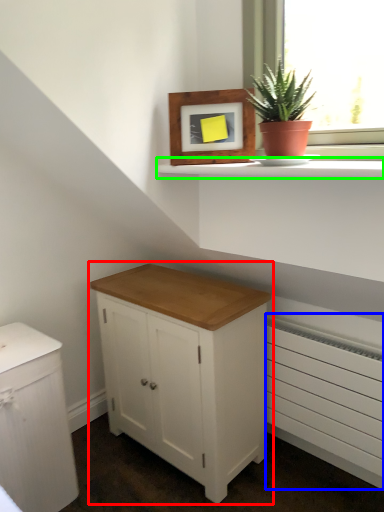
Question: Estimate the real-world distances between objects in this image. Which object is closer to chest of drawers (highlighted by a red box), radiator (highlighted by a blue box) or window sill (highlighted by a green box)?

Choices:
 (A) radiator
 (B) window sill

Answer: (A)